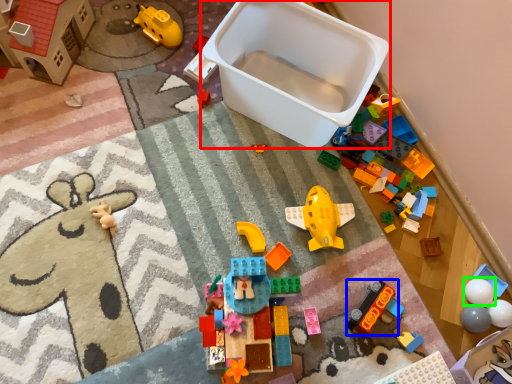
Question: Which is farther away from storage box (highlighted by a red box)? toy (highlighted by a blue box) or toy (highlighted by a green box)?

Choices:
 (A) toy
 (B) toy

Answer: (B)